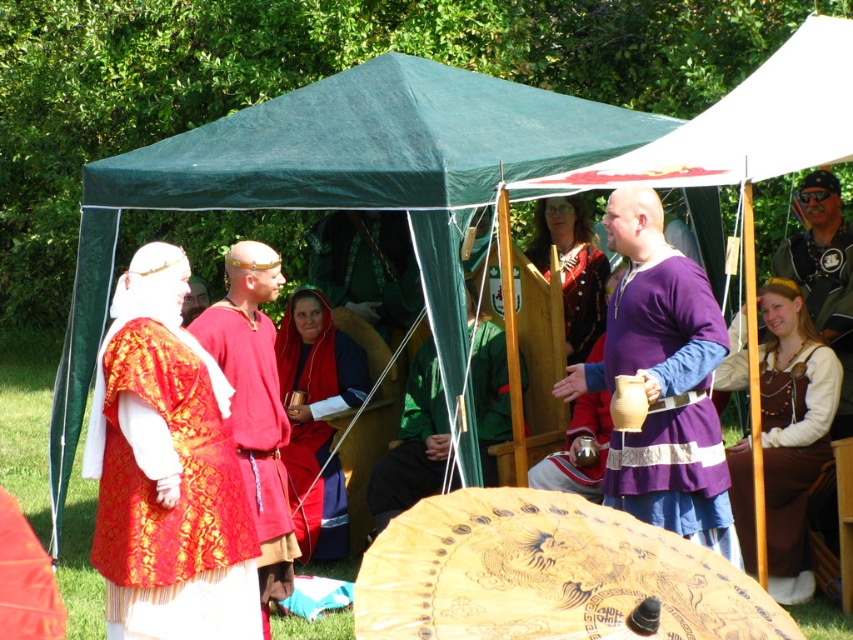
Can you confirm if brown leather apron at right is shorter than matte red fabric at center?

Indeed, brown leather apron at right has a lesser height compared to matte red fabric at center.

Consider the image. Is brown leather apron at right to the left of matte red fabric at center from the viewer's perspective?

In fact, brown leather apron at right is to the right of matte red fabric at center.

Who is more distant from viewer, (763,428) or (325,438)?

The point (325,438) is behind.

This screenshot has height=640, width=853. Find the location of `brown leather apron at right`. brown leather apron at right is located at coordinates (793, 449).

Who is positioned more to the left, wooden carved umbrella at center or matte gold brocade vest at left?

Positioned to the left is matte gold brocade vest at left.

Which of these two, wooden carved umbrella at center or matte gold brocade vest at left, stands shorter?

wooden carved umbrella at center

The width and height of the screenshot is (853, 640). What do you see at coordinates (549, 576) in the screenshot?
I see `wooden carved umbrella at center` at bounding box center [549, 576].

Identify the location of wooden carved umbrella at center. (549, 576).

Between wooden carved umbrella at center and leather jacket at upper right, which one appears on the left side from the viewer's perspective?

Positioned to the left is wooden carved umbrella at center.

Can you confirm if wooden carved umbrella at center is shorter than leather jacket at upper right?

Indeed, wooden carved umbrella at center has a lesser height compared to leather jacket at upper right.

Does point (550, 573) lie in front of point (840, 349)?

Yes.

What are the coordinates of `wooden carved umbrella at center` in the screenshot? It's located at (549, 576).